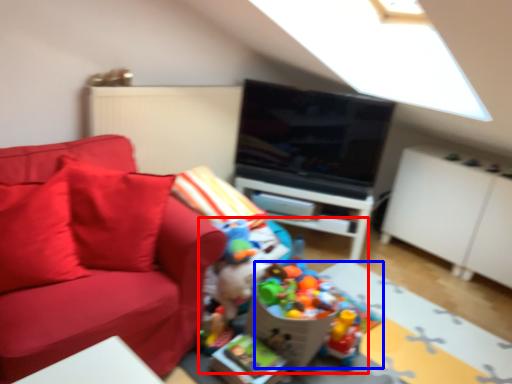
Question: Which object appears closest to the camera in this image, toy (highlighted by a red box) or toy (highlighted by a blue box)?

Choices:
 (A) toy
 (B) toy

Answer: (A)